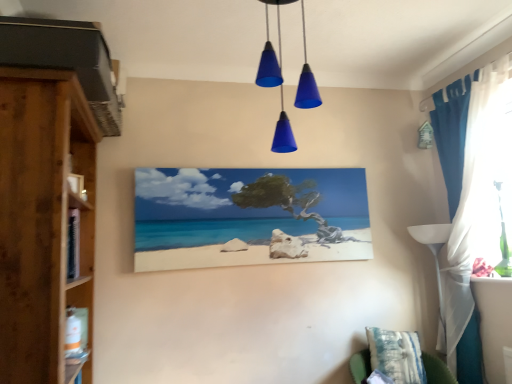
What do you see at coordinates (465, 206) in the screenshot? The height and width of the screenshot is (384, 512). I see `blue fabric curtain at right` at bounding box center [465, 206].

What is the approximate width of blue striped pillow at lower right?

It is 25.03 centimeters.

Identify the location of matte canvas painting at center. (249, 217).

The image size is (512, 384). I want to click on blue matte cone lights at center, so click(x=276, y=85).

Is there a large distance between blue striped pillow at lower right and matte canvas painting at center?

No, there isn't a large distance between blue striped pillow at lower right and matte canvas painting at center.

Image resolution: width=512 pixels, height=384 pixels. In order to click on pillow below the matte canvas painting at center (from the image's perspective) in this screenshot , I will do `click(396, 355)`.

Can you confirm if blue striped pillow at lower right is smaller than matte canvas painting at center?

Indeed, blue striped pillow at lower right has a smaller size compared to matte canvas painting at center.

Is blue striped pillow at lower right in front of or behind matte canvas painting at center in the image?

blue striped pillow at lower right is positioned closer to the viewer than matte canvas painting at center.

Image resolution: width=512 pixels, height=384 pixels. Identify the location of pillow that appears below the blue matte cone lights at center (from the image's perspective). (396, 355).

Considering the relative positions of blue striped pillow at lower right and blue matte cone lights at center in the image provided, is blue striped pillow at lower right in front of blue matte cone lights at center?

No, it is not.

In terms of width, does blue striped pillow at lower right look wider or thinner when compared to blue matte cone lights at center?

blue striped pillow at lower right is thinner than blue matte cone lights at center.

From the image's perspective, is blue striped pillow at lower right under blue matte cone lights at center?

Indeed, from the image's perspective, blue striped pillow at lower right is shown beneath blue matte cone lights at center.

Which of these two, blue striped pillow at lower right or blue fabric curtain at right, is wider?

blue striped pillow at lower right.

Between blue striped pillow at lower right and blue fabric curtain at right, which one is positioned in front?

blue fabric curtain at right.

Can you confirm if blue striped pillow at lower right is shorter than blue fabric curtain at right?

Indeed, blue striped pillow at lower right has a lesser height compared to blue fabric curtain at right.

In the scene shown: From the image's perspective, is blue striped pillow at lower right above or below blue fabric curtain at right?

Based on their image positions, blue striped pillow at lower right is located beneath blue fabric curtain at right.

Locate an element on the screen. This screenshot has width=512, height=384. curtain behind the blue matte cone lights at center is located at coordinates (465, 206).

Is blue fabric curtain at right bigger or smaller than blue matte cone lights at center?

Clearly, blue fabric curtain at right is larger in size than blue matte cone lights at center.

From a real-world perspective, which is physically above, blue fabric curtain at right or blue matte cone lights at center?

blue matte cone lights at center is physically above.

Can you tell me how much blue fabric curtain at right and blue matte cone lights at center differ in facing direction?

The angular difference between blue fabric curtain at right and blue matte cone lights at center is 92.5 degrees.

Where is `curtain in front of the matte canvas painting at center`? This screenshot has height=384, width=512. curtain in front of the matte canvas painting at center is located at coordinates (465, 206).

Considering the relative positions of matte canvas painting at center and blue fabric curtain at right in the image provided, is matte canvas painting at center in front of blue fabric curtain at right?

No, matte canvas painting at center is further to the viewer.

From a real-world perspective, is matte canvas painting at center under blue fabric curtain at right?

No, from a real-world perspective, matte canvas painting at center is not under blue fabric curtain at right.

Is matte canvas painting at center bigger or smaller than blue fabric curtain at right?

In the image, matte canvas painting at center appears to be smaller than blue fabric curtain at right.

From the picture: From the image's perspective, would you say blue matte cone lights at center is shown under wooden cupboard at left?

Actually, blue matte cone lights at center appears above wooden cupboard at left in the image.

How different are the orientations of blue matte cone lights at center and wooden cupboard at left in degrees?

blue matte cone lights at center and wooden cupboard at left are facing 88.7 degrees away from each other.

From a real-world perspective, is blue matte cone lights at center on wooden cupboard at left?

Yes, from a real-world perspective, blue matte cone lights at center is over wooden cupboard at left

Is there a large distance between blue matte cone lights at center and wooden cupboard at left?

No.

Is point (408, 362) more distant than point (36, 317)?

Yes, point (408, 362) is behind point (36, 317).

Does blue striped pillow at lower right appear on the right side of wooden cupboard at left?

Yes, blue striped pillow at lower right is to the right of wooden cupboard at left.

From the image's perspective, which object appears higher, blue striped pillow at lower right or wooden cupboard at left?

Answer: From the image's view, wooden cupboard at left is above.

Identify the location of picture frame above the blue striped pillow at lower right (from a real-world perspective). (249, 217).

The image size is (512, 384). I want to click on pillow beneath the blue matte cone lights at center (from a real-world perspective), so click(396, 355).

From the picture: When comparing their distances from blue fabric curtain at right, does blue matte cone lights at center or blue striped pillow at lower right seem further?

blue matte cone lights at center.

Based on their spatial positions, is blue matte cone lights at center or blue fabric curtain at right closer to blue striped pillow at lower right?

Among the two, blue fabric curtain at right is located nearer to blue striped pillow at lower right.

Which object lies further to the anchor point matte canvas painting at center, blue striped pillow at lower right or blue fabric curtain at right?

blue fabric curtain at right lies further to matte canvas painting at center than the other object.

Based on their spatial positions, is matte canvas painting at center or blue striped pillow at lower right further from blue fabric curtain at right?

Among the two, matte canvas painting at center is located further to blue fabric curtain at right.

When comparing their distances from wooden cupboard at left, does blue fabric curtain at right or blue striped pillow at lower right seem closer?

blue striped pillow at lower right is positioned closer to the anchor wooden cupboard at left.

Looking at the image, which one is located further to matte canvas painting at center, blue matte cone lights at center or wooden cupboard at left?

wooden cupboard at left is further to matte canvas painting at center.

From the picture: Which object lies further to the anchor point blue fabric curtain at right, blue striped pillow at lower right or blue matte cone lights at center?

blue matte cone lights at center is positioned further to the anchor blue fabric curtain at right.

Which object lies nearer to the anchor point blue fabric curtain at right, wooden cupboard at left or blue striped pillow at lower right?

blue striped pillow at lower right is closer to blue fabric curtain at right.

Where is `light fixture between wooden cupboard at left and blue striped pillow at lower right`? This screenshot has width=512, height=384. light fixture between wooden cupboard at left and blue striped pillow at lower right is located at coordinates (276, 85).

This screenshot has width=512, height=384. Identify the location of light fixture situated between matte canvas painting at center and blue fabric curtain at right from left to right. [x=276, y=85].

Identify the location of curtain between blue matte cone lights at center and blue striped pillow at lower right vertically. The width and height of the screenshot is (512, 384). (465, 206).

Locate an element on the screen. picture frame situated between wooden cupboard at left and blue matte cone lights at center from left to right is located at coordinates (249, 217).